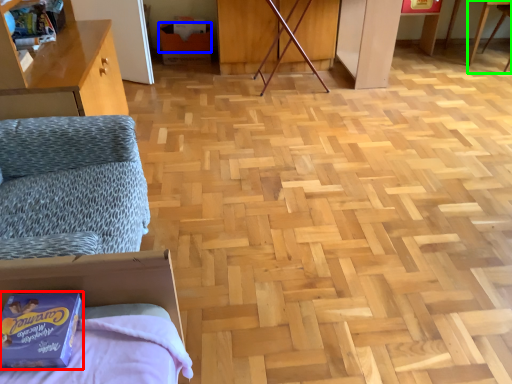
Question: Considering the real-world distances, which object is closest to package (highlighted by a red box)? cardboard box (highlighted by a blue box) or table (highlighted by a green box).

Choices:
 (A) cardboard box
 (B) table

Answer: (A)